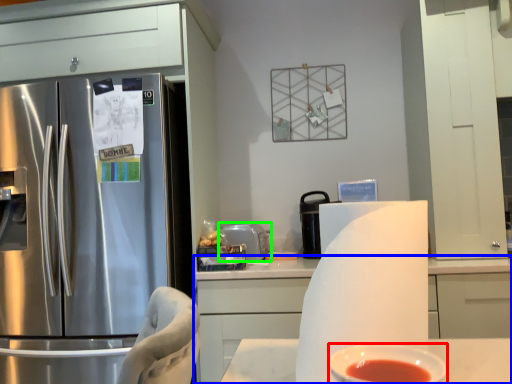
Question: Based on their relative distances, which object is farther from bowl (highlighted by a red box)? Choose from cabinetry (highlighted by a blue box) and appliance (highlighted by a green box).

Choices:
 (A) cabinetry
 (B) appliance

Answer: (B)